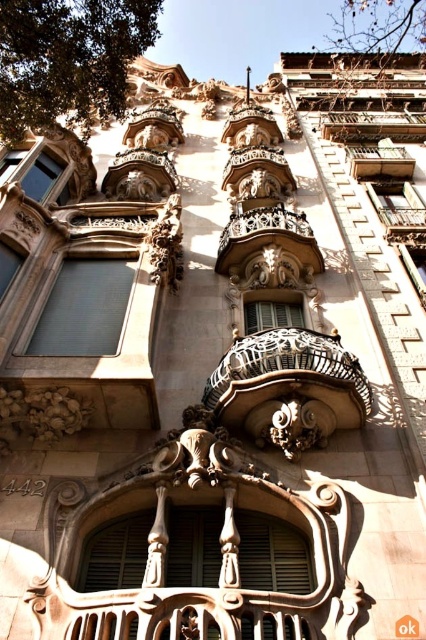
Question: Which object is farther from the camera taking this photo?

Choices:
 (A) matte metal window at center
 (B) polished bronze balcony at center
 (C) matte gray window at left

Answer: (B)

Question: Is polished wrought iron balcony at center to the right of matte gray window at center from the viewer's perspective?

Choices:
 (A) yes
 (B) no

Answer: (A)

Question: Which object appears closest to the camera in this image?

Choices:
 (A) matte metal window at center
 (B) wooden lattice balcony at center
 (C) matte gray window at center

Answer: (C)

Question: Estimate the real-world distances between objects in this image. Which object is closer to the matte gray window at center?

Choices:
 (A) wooden lattice balcony at center
 (B) matte gray window at left

Answer: (B)

Question: Where is polished wrought iron balcony at center located in relation to matte gray window at center in the image?

Choices:
 (A) left
 (B) right

Answer: (B)

Question: Does polished bronze balcony at center have a greater width compared to wooden lattice balcony at center?

Choices:
 (A) no
 (B) yes

Answer: (B)